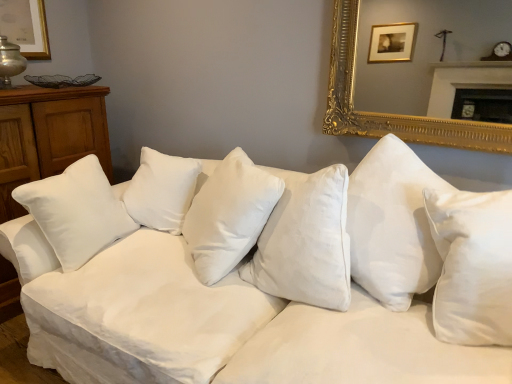
Question: Is white satin pillow at center next to white cotton couch at center?

Choices:
 (A) no
 (B) yes

Answer: (A)

Question: Is white cotton couch at center a part of white satin pillow at center?

Choices:
 (A) no
 (B) yes

Answer: (A)

Question: Considering the relative positions of white satin pillow at center and white cotton couch at center in the image provided, is white satin pillow at center to the right of white cotton couch at center from the viewer's perspective?

Choices:
 (A) no
 (B) yes

Answer: (A)

Question: Considering the relative sizes of white satin pillow at center and white cotton couch at center in the image provided, is white satin pillow at center smaller than white cotton couch at center?

Choices:
 (A) yes
 (B) no

Answer: (A)

Question: Does white satin pillow at center have a greater width compared to white cotton couch at center?

Choices:
 (A) no
 (B) yes

Answer: (A)

Question: Considering the relative positions of white satin pillow at center and white cotton couch at center in the image provided, is white satin pillow at center to the left of white cotton couch at center from the viewer's perspective?

Choices:
 (A) yes
 (B) no

Answer: (A)

Question: Can you see white cotton couch at center touching white satin pillow at center?

Choices:
 (A) no
 (B) yes

Answer: (A)

Question: Are white cotton couch at center and white satin pillow at center located far from each other?

Choices:
 (A) no
 (B) yes

Answer: (A)

Question: Can you confirm if white cotton couch at center is smaller than white satin pillow at center?

Choices:
 (A) yes
 (B) no

Answer: (B)

Question: Is white cotton couch at center thinner than white satin pillow at center?

Choices:
 (A) yes
 (B) no

Answer: (B)

Question: Could you tell me if white cotton couch at center is turned towards white satin pillow at center?

Choices:
 (A) yes
 (B) no

Answer: (A)

Question: Does white cotton couch at center have a larger size compared to white satin pillow at center?

Choices:
 (A) yes
 (B) no

Answer: (A)

Question: Considering the positions of white satin pillow at center and white cotton couch at center in the image, is white satin pillow at center wider or thinner than white cotton couch at center?

Choices:
 (A) wide
 (B) thin

Answer: (B)